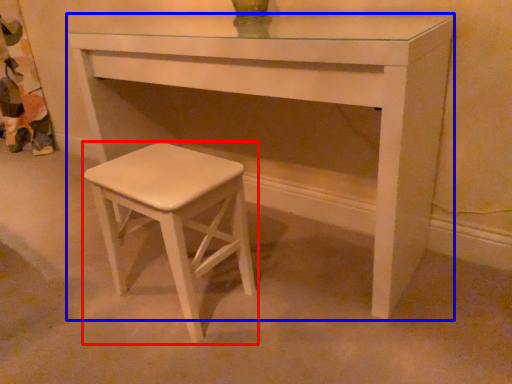
Question: Which of the following is the farthest to the observer, stool (highlighted by a red box) or table (highlighted by a blue box)?

Choices:
 (A) stool
 (B) table

Answer: (A)